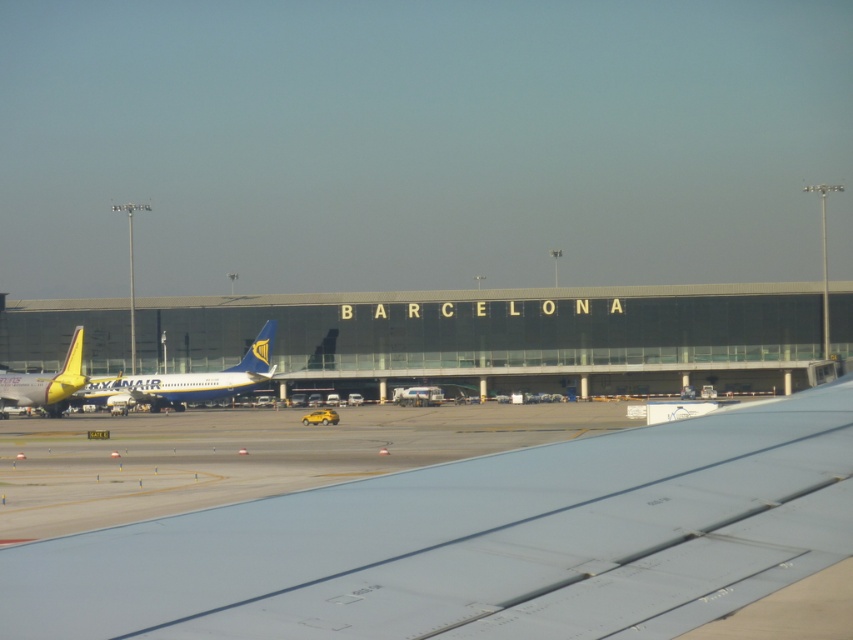
Does metallic gray wing at lower center have a greater height compared to yellow matte airplane at left?

No.

Image resolution: width=853 pixels, height=640 pixels. Describe the element at coordinates (479, 541) in the screenshot. I see `metallic gray wing at lower center` at that location.

Who is more forward, (x=200, y=518) or (x=27, y=403)?

Positioned in front is point (x=200, y=518).

Identify the location of metallic gray wing at lower center. The image size is (853, 640). (479, 541).

Who is positioned more to the left, blue metallic airplane at center or yellow matte airplane at left?

yellow matte airplane at left is more to the left.

Between point (112, 401) and point (47, 380), which one is positioned in front?

Point (47, 380) is more forward.

Does point (163, 380) come in front of point (27, 394)?

No, it is not.

Image resolution: width=853 pixels, height=640 pixels. I want to click on blue metallic airplane at center, so click(x=187, y=380).

Does metallic gray wing at lower center appear over blue metallic airplane at center?

Indeed, metallic gray wing at lower center is positioned over blue metallic airplane at center.

Is metallic gray wing at lower center to the right of blue metallic airplane at center from the viewer's perspective?

Correct, you'll find metallic gray wing at lower center to the right of blue metallic airplane at center.

Who is more forward, (x=764, y=580) or (x=264, y=337)?

Positioned in front is point (x=764, y=580).

The height and width of the screenshot is (640, 853). I want to click on metallic gray wing at lower center, so click(x=479, y=541).